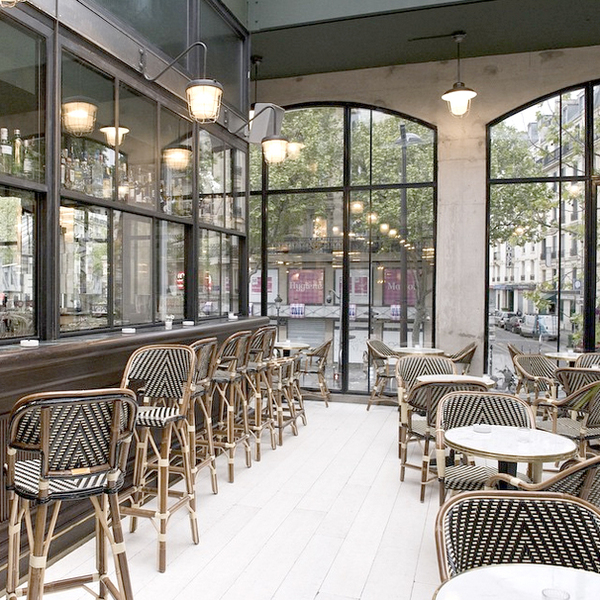
This screenshot has width=600, height=600. Find the location of `ash trays`. ash trays is located at coordinates (30, 342), (130, 329), (188, 321), (232, 315), (482, 426).